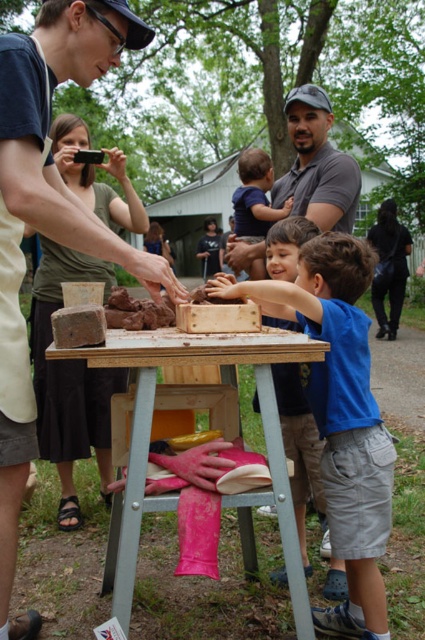
You are a photographer taking a picture of the scene. You want to ensure both the matte green shirt at upper left and the black leather jacket at lower right are in the frame. Based on their positions, which object should you position closer to the left side of the camera frame?

The matte green shirt at upper left should be positioned closer to the left side of the camera frame since it is located to the left of the black leather jacket at lower right in the scene.

You are standing in the outdoor scene and want to know which object is taller between the blue cotton shirt at center and the wooden table at center. Can you determine this based on the scene?

Result: The blue cotton shirt at center is taller than the wooden table at center.

You are organizing a workshop and need to arrange seating for participants. The space has limited width. Which object, the matte green shirt at upper left or the black leather jacket at lower right, requires more space horizontally?

The black leather jacket at lower right requires more horizontal space because its width is greater than the matte green shirt at upper left.